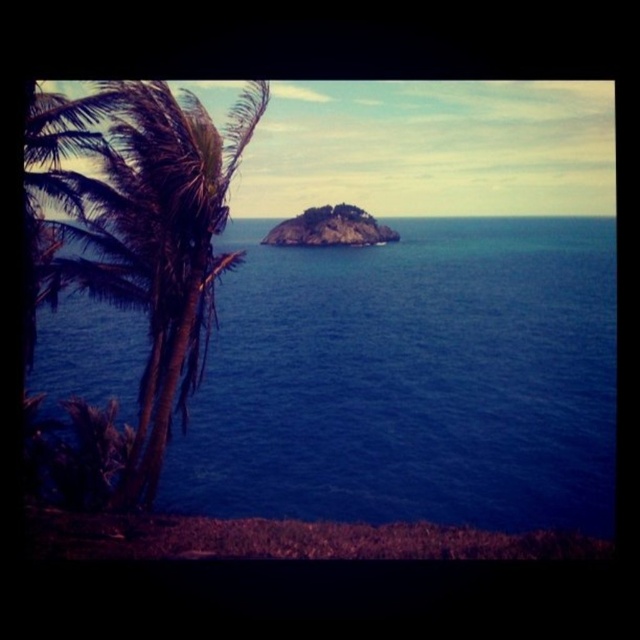
Question: Is green leafy palm tree at left closer to camera compared to brown grass at lower center?

Choices:
 (A) no
 (B) yes

Answer: (A)

Question: Can you confirm if brown grass at lower center is thinner than green mossy rock at center?

Choices:
 (A) no
 (B) yes

Answer: (A)

Question: Which object appears farthest from the camera in this image?

Choices:
 (A) blue liquid water at center
 (B) green leafy palm tree at left
 (C) brown grass at lower center

Answer: (A)

Question: Among these objects, which one is nearest to the camera?

Choices:
 (A) brown grass at lower center
 (B) green leafy palm tree at left

Answer: (A)

Question: Is blue liquid water at center above green leafy palm tree at left?

Choices:
 (A) no
 (B) yes

Answer: (A)

Question: Which object appears farthest from the camera in this image?

Choices:
 (A) brown grass at lower center
 (B) green mossy rock at center
 (C) blue liquid water at center
 (D) green leafy palm tree at left

Answer: (B)